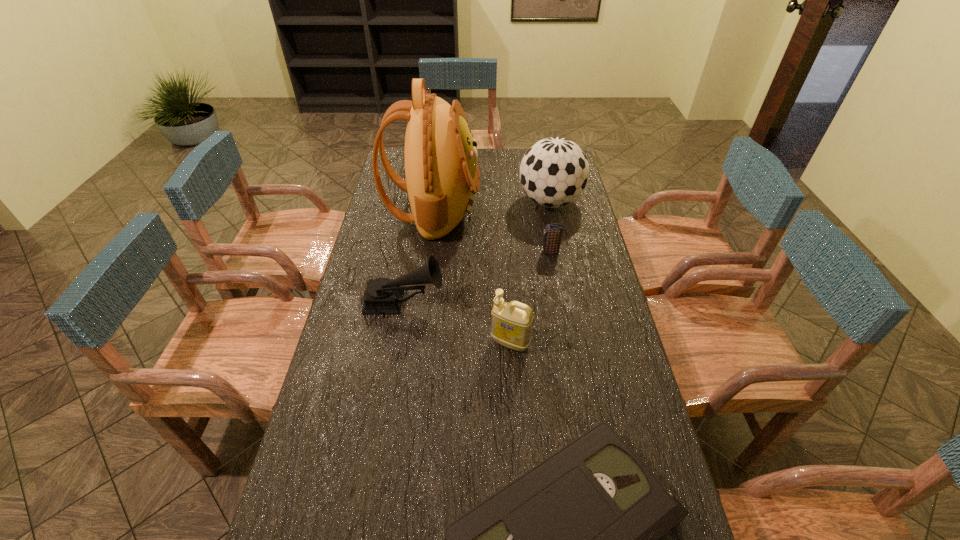
The image size is (960, 540). I want to click on blank area in the image that satisfies the following two spatial constraints: 1. from the horn of the fifth farthest object; 2. on the right side of the phonograph_record, so click(397, 343).